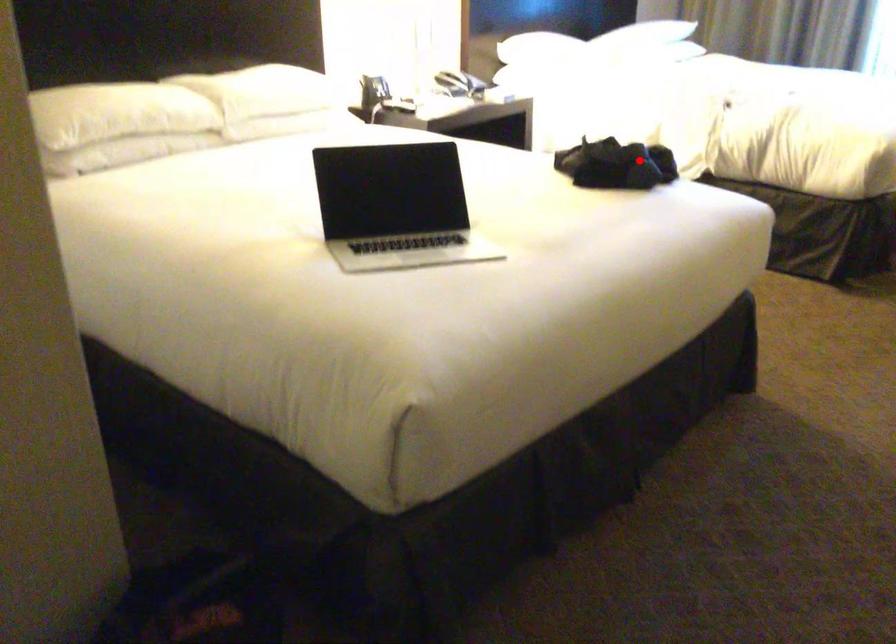
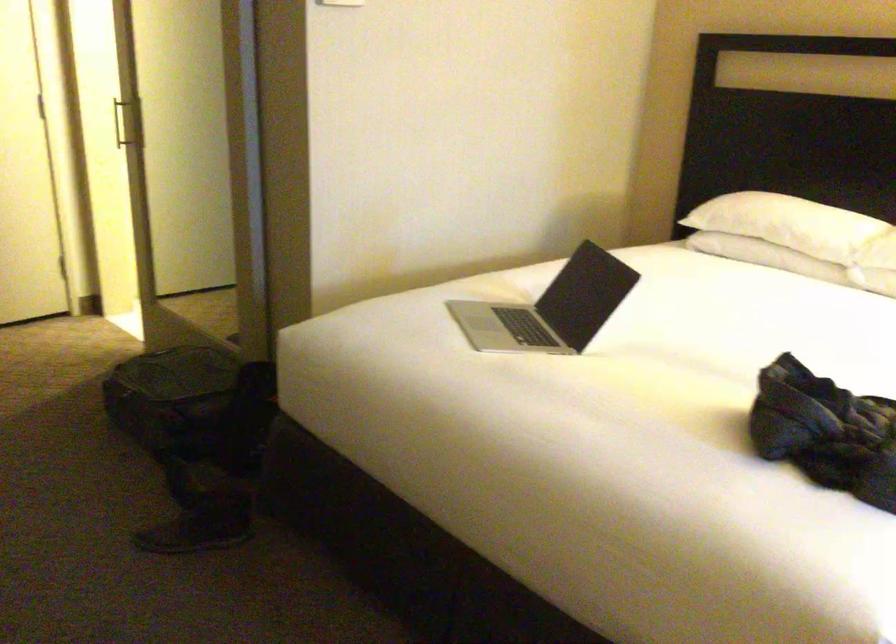
Question: I am providing you with two images of the same scene from different viewpoints. Given a red point in image1, look at the same physical point in image2. Is it:

Choices:
 (A) Closer to the viewpoint
 (B) Farther from the viewpoint

Answer: (A)